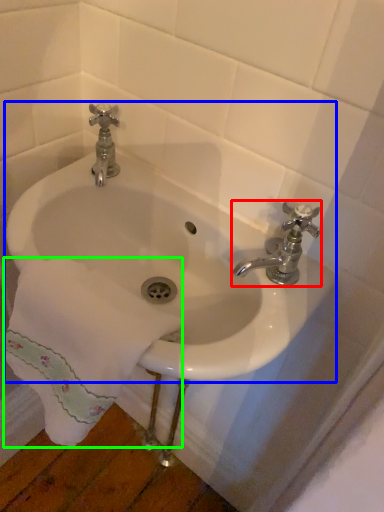
Question: Estimate the real-world distances between objects in this image. Which object is farther from tap (highlighted by a red box), sink (highlighted by a blue box) or bath towel (highlighted by a green box)?

Choices:
 (A) sink
 (B) bath towel

Answer: (B)